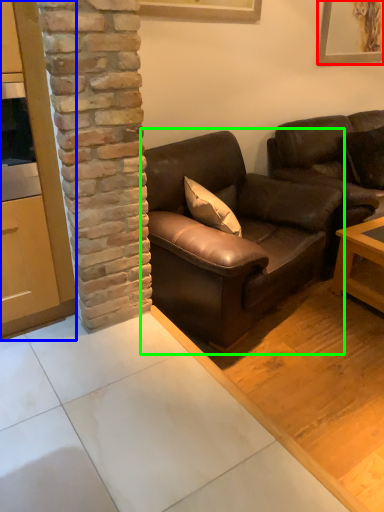
Question: Considering the real-world distances, which object is closest to picture frame (highlighted by a red box)? cabinetry (highlighted by a blue box) or studio couch (highlighted by a green box).

Choices:
 (A) cabinetry
 (B) studio couch

Answer: (B)